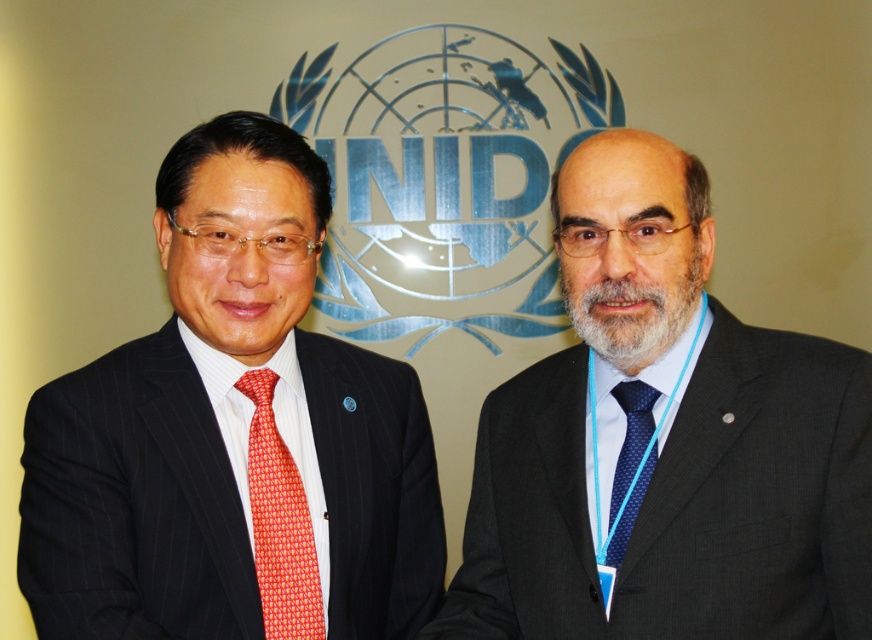
Question: Which point is farther from the camera taking this photo?

Choices:
 (A) (617, 465)
 (B) (283, 483)
 (C) (734, 554)
 (D) (278, 186)

Answer: (B)

Question: Is red silk tie at left above blue dotted tie at center?

Choices:
 (A) yes
 (B) no

Answer: (B)

Question: Which point appears closest to the camera in this image?

Choices:
 (A) (618, 518)
 (B) (368, 426)
 (C) (256, 557)

Answer: (A)

Question: Is dark gray suit at center below blue dotted tie at center?

Choices:
 (A) no
 (B) yes

Answer: (A)

Question: Which point appears farthest from the camera in this image?

Choices:
 (A) (283, 545)
 (B) (560, 412)
 (C) (175, 216)
 (D) (615, 392)

Answer: (B)

Question: Is matte black suit at left smaller than red silk tie at left?

Choices:
 (A) no
 (B) yes

Answer: (A)